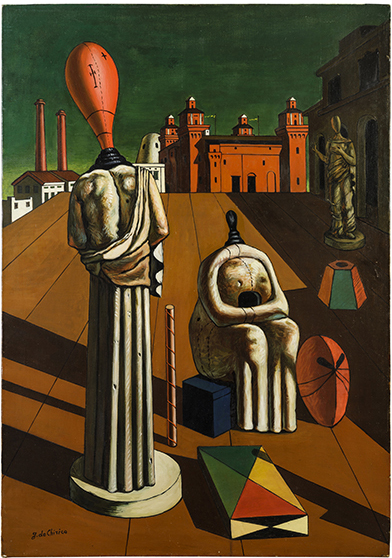
Identify the location of box. This screenshot has width=392, height=558. (214, 399).